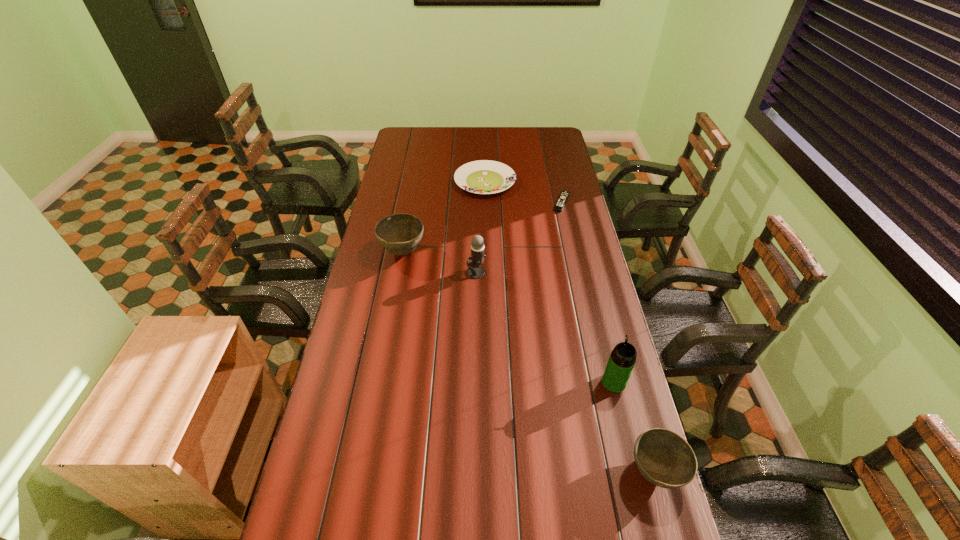
Please point a spot to place another bowl for symmetrical spacing. Please provide its 2D coordinates. Your answer should be formatted as a tuple, i.e. [(x, y)], where the tuple contains the x and y coordinates of a point satisfying the conditions above.

[(502, 339)]